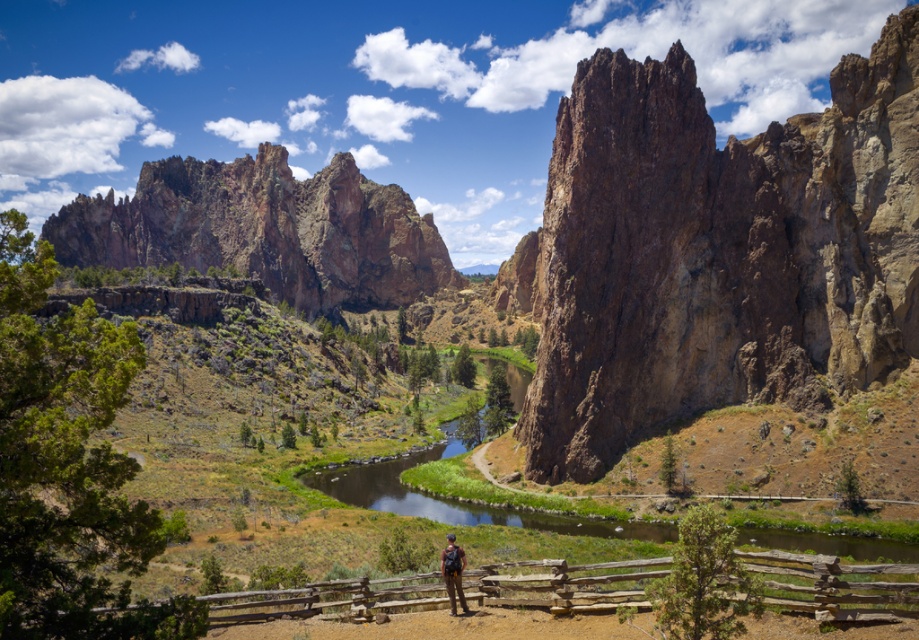
Question: Which of the following is the closest to the observer?

Choices:
 (A) brown wooden fence at lower center
 (B) brown leather backpack at center
 (C) rustic brown rock at center

Answer: (A)

Question: Which point appears closest to the camera in this image?

Choices:
 (A) (762, 228)
 (B) (441, 570)

Answer: (B)

Question: Is rustic brown rock at center to the right of brown leather backpack at center from the viewer's perspective?

Choices:
 (A) no
 (B) yes

Answer: (B)

Question: Is rustic rock formation at upper left thinner than brown leather backpack at center?

Choices:
 (A) yes
 (B) no

Answer: (B)

Question: From the image, what is the correct spatial relationship of rustic brown rock at center in relation to brown wooden fence at lower center?

Choices:
 (A) below
 (B) above

Answer: (B)

Question: Which point is closer to the camera?

Choices:
 (A) (586, 458)
 (B) (307, 262)

Answer: (A)